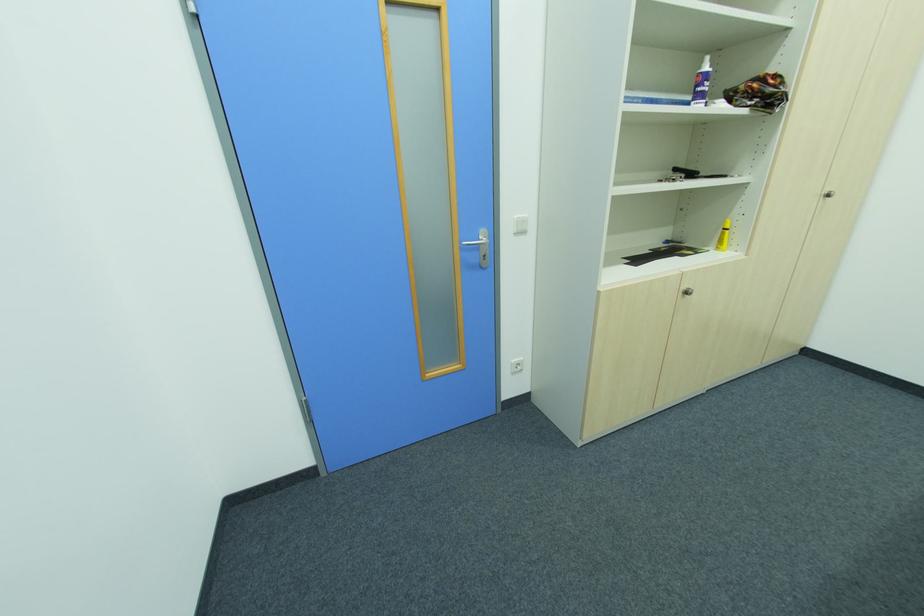
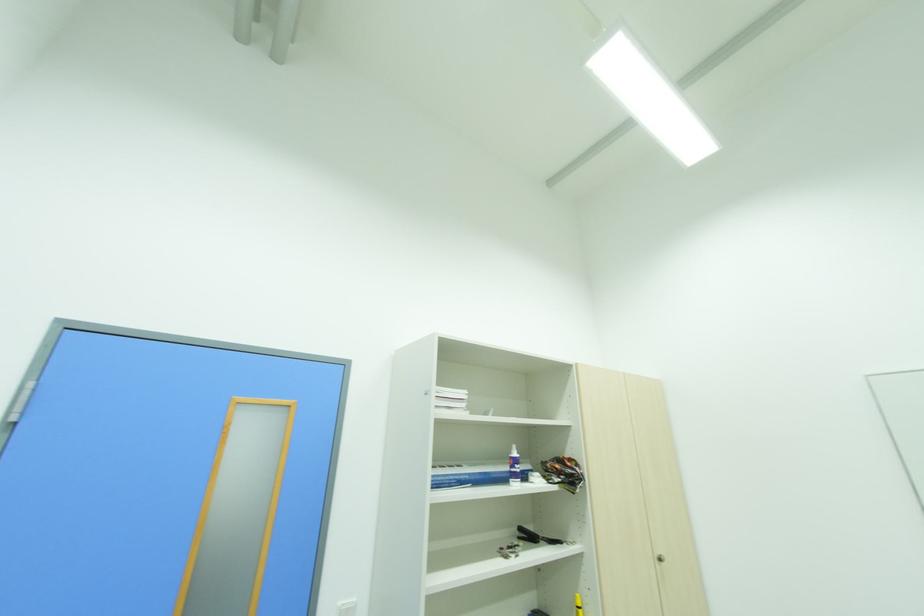
The point at [830,196] is marked in the first image. Where is the corresponding point in the second image?

(663, 561)